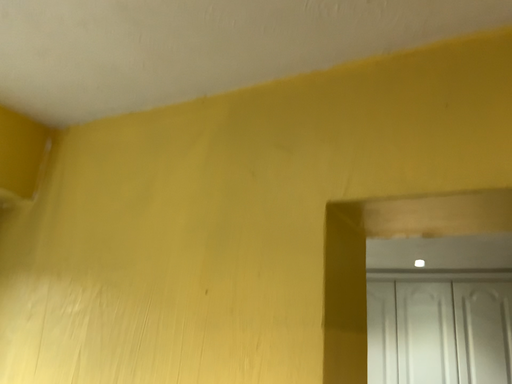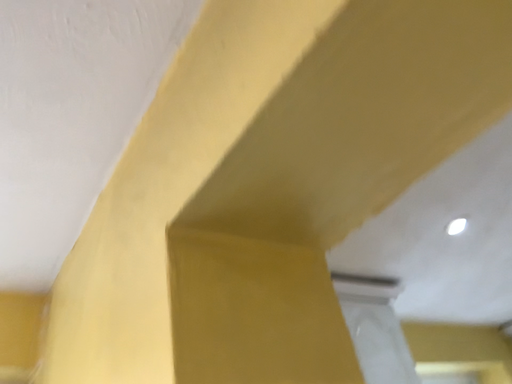
Question: How did the camera likely rotate when shooting the video?

Choices:
 (A) rotated upward
 (B) rotated downward

Answer: (A)